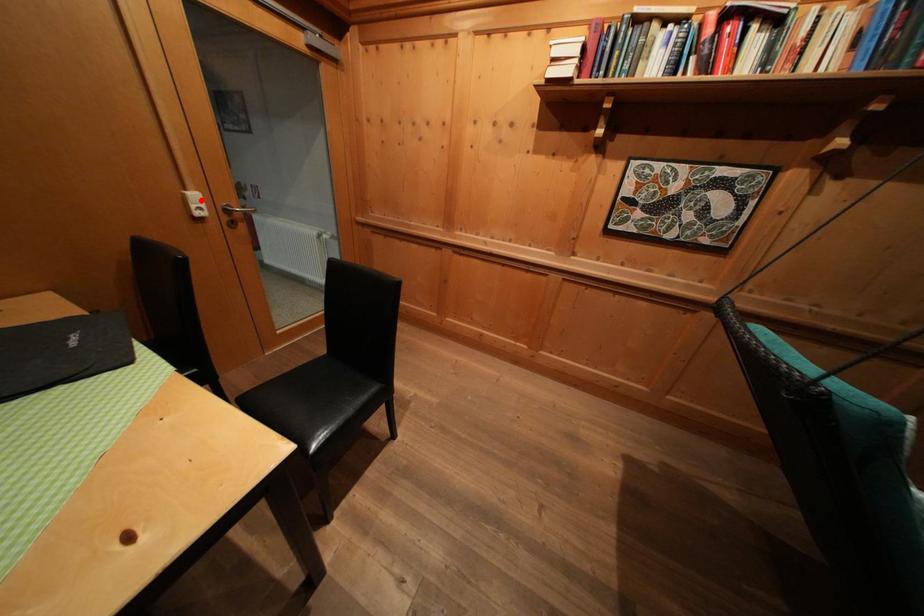
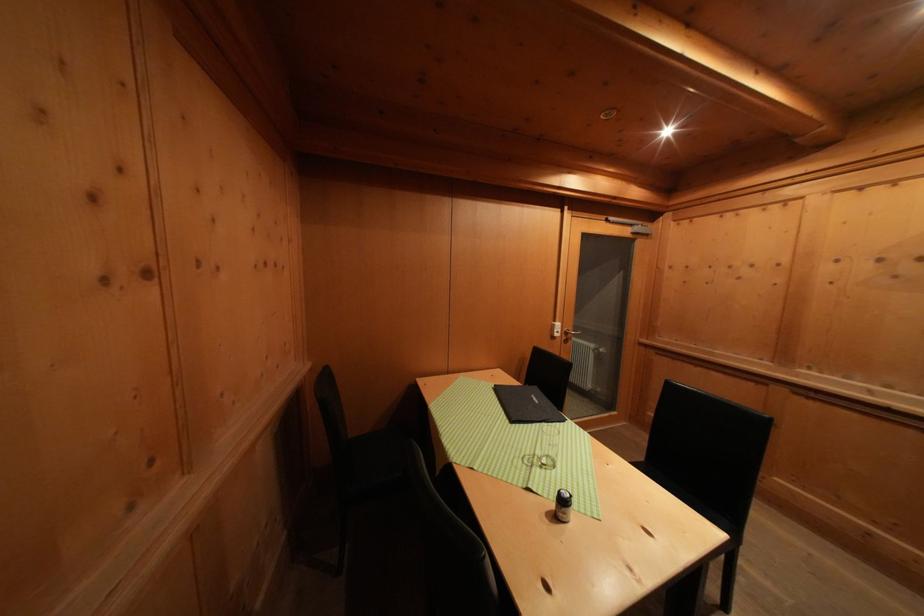
The point at the highlighted location is marked in the first image. Where is the corresponding point in the second image?

(564, 330)